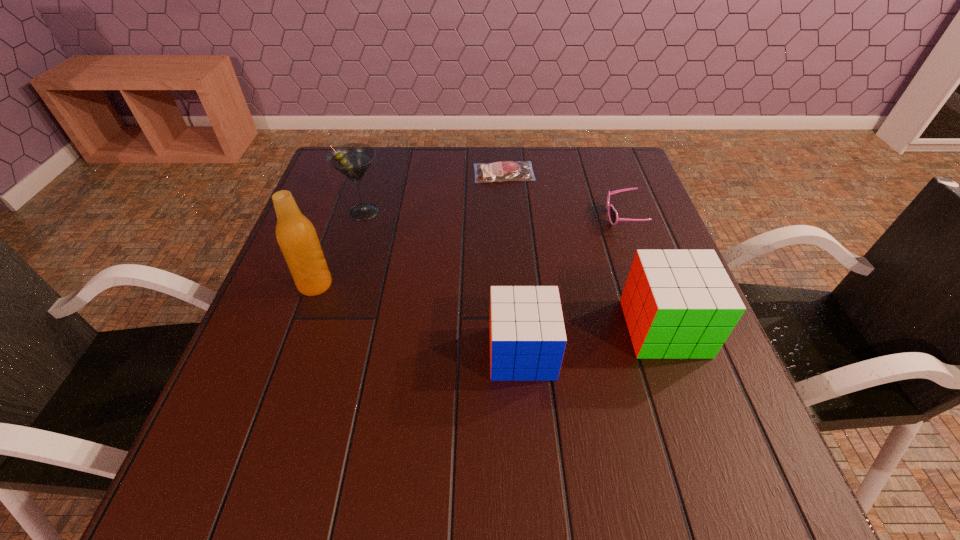
Locate an element on the screen. This screenshot has height=540, width=960. beer bottle that is at the left edge is located at coordinates (297, 238).

This screenshot has height=540, width=960. I want to click on cube that is at the right edge, so click(678, 304).

What are the coordinates of `sunglasses present at the right edge` in the screenshot? It's located at (612, 213).

Locate an element on the screen. Image resolution: width=960 pixels, height=540 pixels. free spot at the far edge of the desktop is located at coordinates (442, 159).

In the image, there is a desktop. Identify the location of vacant space at the near edge. (369, 393).

Where is `free space at the left edge of the desktop`? This screenshot has width=960, height=540. free space at the left edge of the desktop is located at coordinates (364, 228).

Identify the location of vacant space at the right edge of the desktop. The width and height of the screenshot is (960, 540). (658, 222).

Find the location of a particular element. free space at the far right corner of the desktop is located at coordinates [579, 158].

I want to click on vacant space at the near right corner of the desktop, so click(708, 404).

This screenshot has height=540, width=960. In order to click on empty space between the second shortest object and the fourth tallest object in this screenshot , I will do `click(572, 285)`.